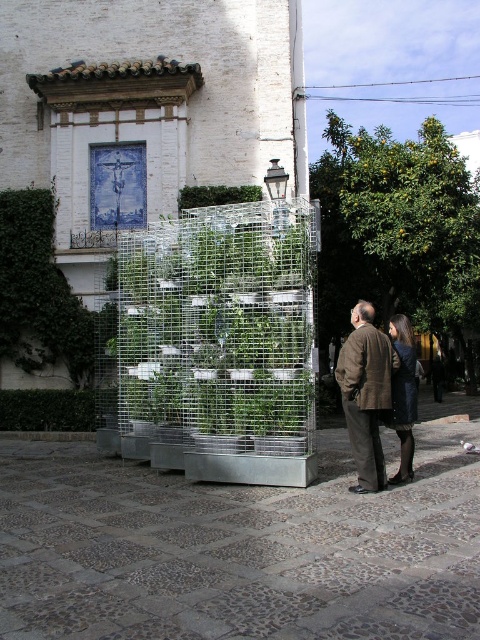
You are an artist planning to photograph the brown woolen coat at center and the green leafy hedge at lower left. Which object would require a wider angle lens to capture its entirety?

The green leafy hedge at lower left would require a wider angle lens because it occupies more space than the brown woolen coat at center.

You are an architect designing a new garden path that needs to pass between the green ivy hedge at upper left and the green leafy hedge at lower left. Based on their positions, which hedge will the path go behind?

The green leafy hedge at lower left is behind the green ivy hedge at upper left, so the path will go behind the green ivy hedge at upper left.